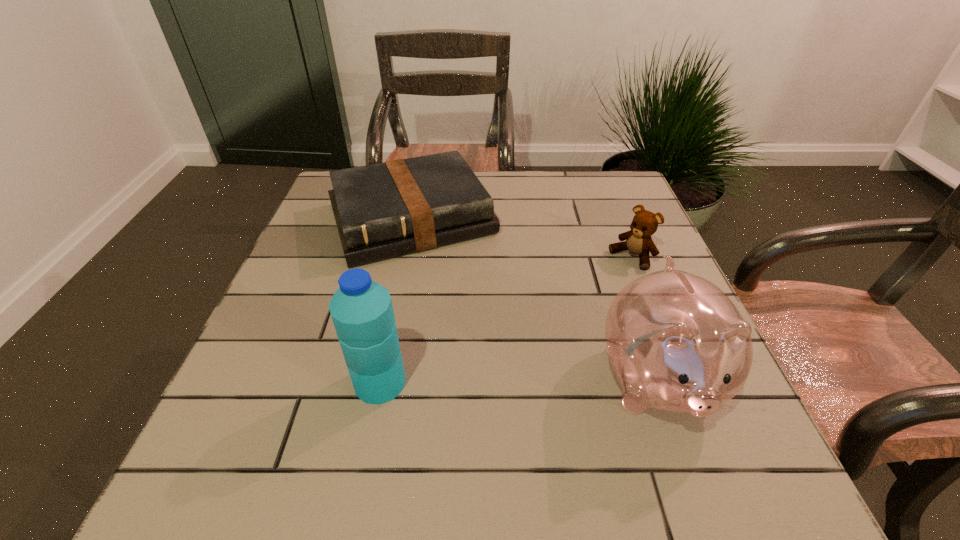
At what (x,y) coordinates should I click in order to perform the action: click on blank space located 0.390m on the spine side of the hardback book. Please return your answer as a coordinate pair (x, y). The width and height of the screenshot is (960, 540). Looking at the image, I should click on tap(506, 403).

Where is `object present at the far edge`? This screenshot has height=540, width=960. object present at the far edge is located at coordinates (385, 210).

Locate an element on the screen. water bottle that is at the near edge is located at coordinates (362, 312).

Locate an element on the screen. This screenshot has width=960, height=540. piggy bank that is at the near edge is located at coordinates (676, 342).

The height and width of the screenshot is (540, 960). I want to click on object present at the left edge, so click(385, 210).

This screenshot has height=540, width=960. Find the location of `piggy bank situated at the right edge`. piggy bank situated at the right edge is located at coordinates (676, 342).

Image resolution: width=960 pixels, height=540 pixels. Find the location of `teddy bear present at the right edge`. teddy bear present at the right edge is located at coordinates (638, 241).

Where is `object that is at the far left corner`? object that is at the far left corner is located at coordinates click(x=385, y=210).

Locate an element on the screen. The width and height of the screenshot is (960, 540). object located at the near right corner is located at coordinates (676, 342).

In the image, there is a desktop. Identify the location of vacant space at the far edge. (533, 182).